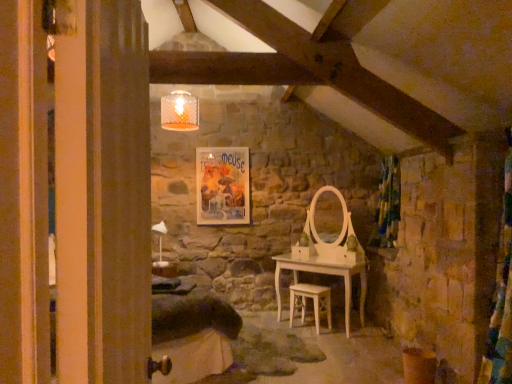
Question: Does matte paper poster at center turn towards light wood chair at center?

Choices:
 (A) yes
 (B) no

Answer: (B)

Question: From the image's perspective, is matte paper poster at center below light wood chair at center?

Choices:
 (A) no
 (B) yes

Answer: (A)

Question: Are matte paper poster at center and light wood chair at center beside each other?

Choices:
 (A) no
 (B) yes

Answer: (A)

Question: Does matte paper poster at center come in front of light wood chair at center?

Choices:
 (A) yes
 (B) no

Answer: (B)

Question: Does matte paper poster at center have a lesser height compared to light wood chair at center?

Choices:
 (A) yes
 (B) no

Answer: (B)

Question: Does matte paper poster at center have a greater height compared to light wood chair at center?

Choices:
 (A) yes
 (B) no

Answer: (A)

Question: Is light wood chair at center to the left of velvet green curtain at right from the viewer's perspective?

Choices:
 (A) no
 (B) yes

Answer: (B)

Question: Is the position of light wood chair at center less distant than that of velvet green curtain at right?

Choices:
 (A) no
 (B) yes

Answer: (B)

Question: From the image's perspective, is light wood chair at center beneath velvet green curtain at right?

Choices:
 (A) yes
 (B) no

Answer: (A)

Question: Does light wood chair at center have a greater height compared to velvet green curtain at right?

Choices:
 (A) yes
 (B) no

Answer: (B)

Question: Does light wood chair at center have a larger size compared to velvet green curtain at right?

Choices:
 (A) no
 (B) yes

Answer: (A)

Question: Is velvet green curtain at right inside light wood chair at center?

Choices:
 (A) yes
 (B) no

Answer: (B)

Question: Does light wood chair at center have a larger size compared to matte paper poster at center?

Choices:
 (A) yes
 (B) no

Answer: (A)